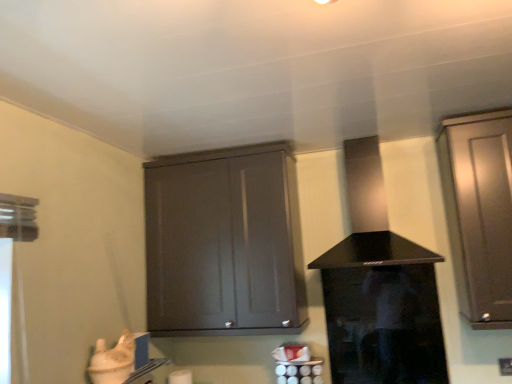
Question: Considering the positions of satin brown cabinet at right, the second cabinetry in the left-to-right sequence, and transparent glass screen door at center in the image, is satin brown cabinet at right, the second cabinetry in the left-to-right sequence, wider or thinner than transparent glass screen door at center?

Choices:
 (A) wide
 (B) thin

Answer: (A)

Question: Would you say satin brown cabinet at right, the second cabinetry in the left-to-right sequence, is inside or outside transparent glass screen door at center?

Choices:
 (A) outside
 (B) inside

Answer: (A)

Question: Which is farther from the transparent glass screen door at center?

Choices:
 (A) black glass vent at center
 (B) matte gray cabinet at center, which appears as the first cabinetry when viewed from the left
 (C) satin brown cabinet at right, the second cabinetry in the left-to-right sequence

Answer: (B)

Question: Which object is positioned closest to the transparent glass screen door at center?

Choices:
 (A) black glass vent at center
 (B) matte gray cabinet at center, the second cabinetry from the right
 (C) satin brown cabinet at right, the second cabinetry in the left-to-right sequence

Answer: (A)